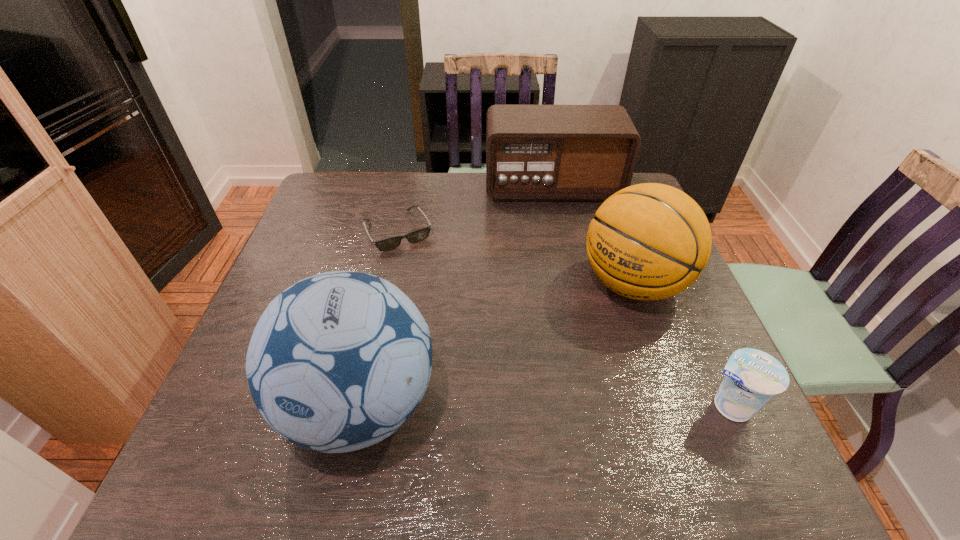
Point out which object is positioned as the third nearest to the soccer ball. Please provide its 2D coordinates. Your answer should be formatted as a tuple, i.e. [(x, y)], where the tuple contains the x and y coordinates of a point satisfying the conditions above.

[(752, 377)]

Locate an element on the screen. This screenshot has height=540, width=960. object that is the second closest one to the third tallest object is located at coordinates (650, 241).

This screenshot has height=540, width=960. Find the location of `free location that satisfies the following two spatial constraints: 1. on the front side of the basketball; 2. on the right side of the shortest object`. free location that satisfies the following two spatial constraints: 1. on the front side of the basketball; 2. on the right side of the shortest object is located at coordinates (388, 284).

Where is `vacant space that satisfies the following two spatial constraints: 1. on the side with brand of the soccer ball; 2. on the right side of the yogurt`? Image resolution: width=960 pixels, height=540 pixels. vacant space that satisfies the following two spatial constraints: 1. on the side with brand of the soccer ball; 2. on the right side of the yogurt is located at coordinates (360, 406).